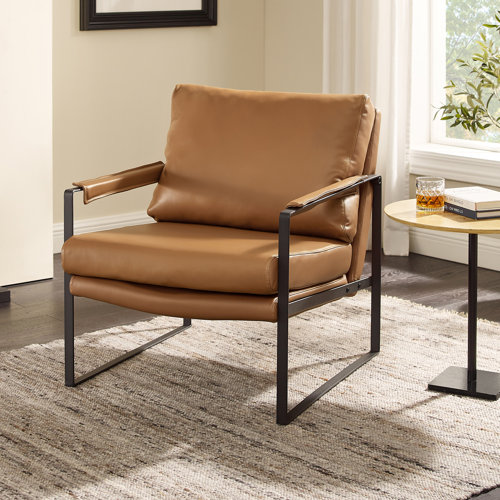
Identify the location of books. This screenshot has width=500, height=500. (461, 201), (458, 208).